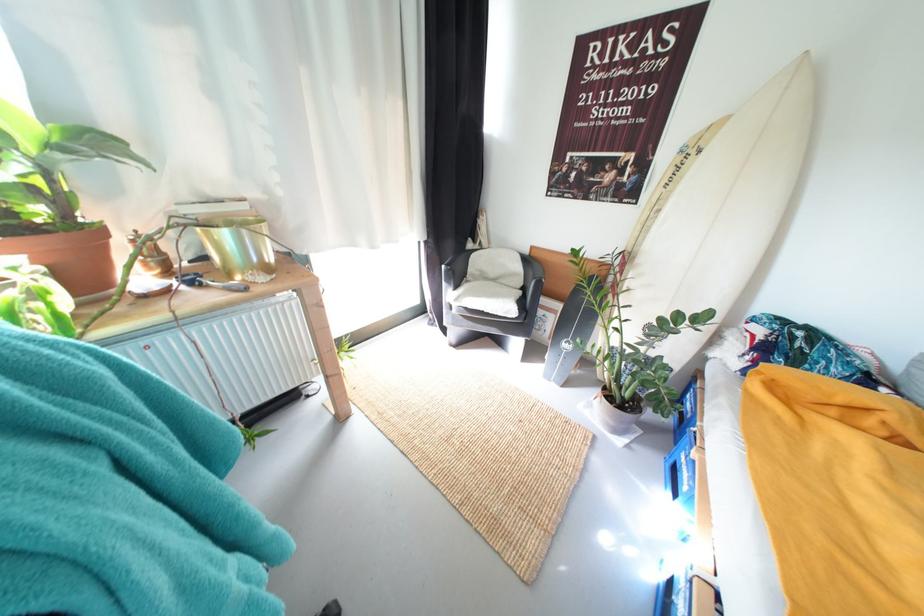
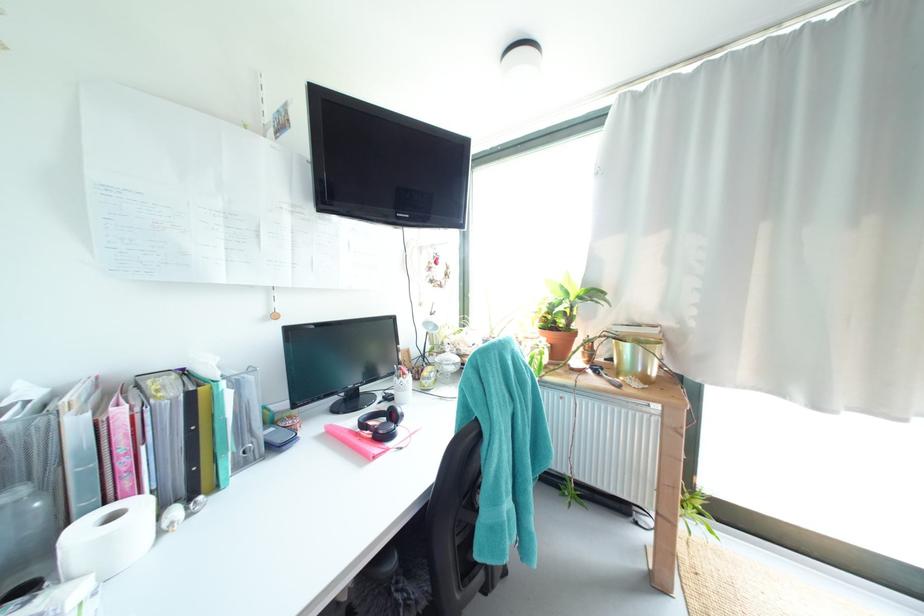
In the second image, find the point that corresponds to [40,188] in the first image.

(573, 315)